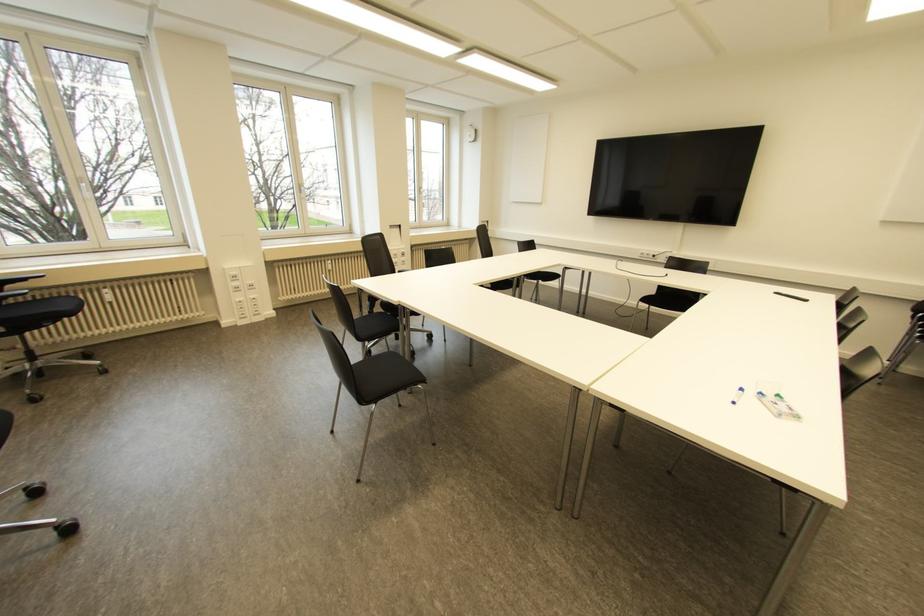
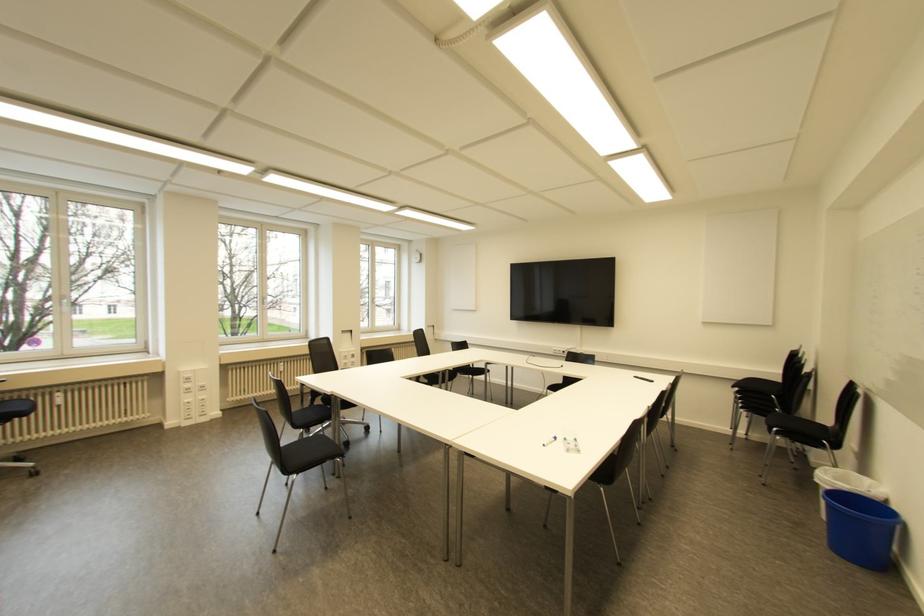
Find the pixel in the second image that matches the point at 299,185 in the first image.

(263, 298)